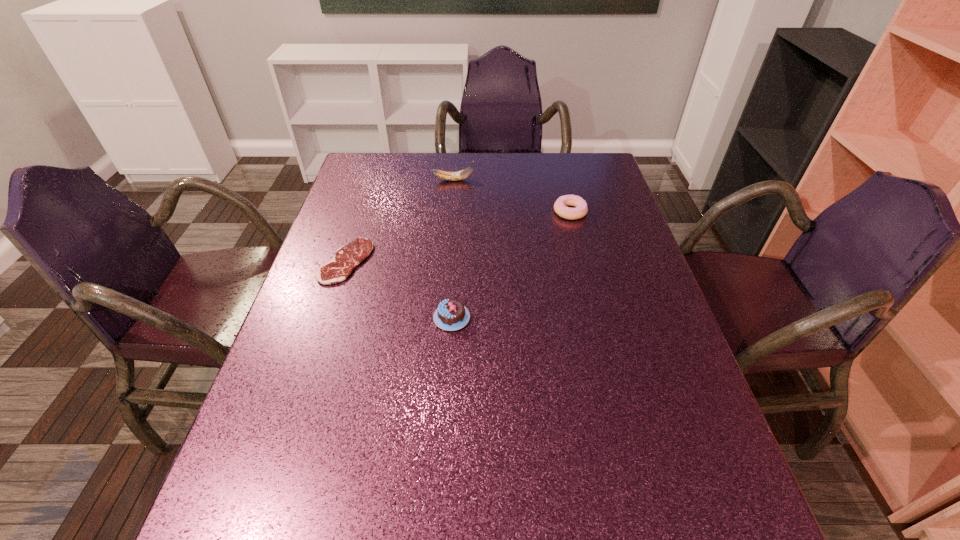
Locate an element on the screen. This screenshot has height=540, width=960. vacant space located on the right of the leftmost object is located at coordinates (420, 261).

Where is `object located in the far edge section of the desktop`? This screenshot has width=960, height=540. object located in the far edge section of the desktop is located at coordinates (459, 175).

I want to click on object present at the left edge, so click(x=347, y=257).

You are a GUI agent. You are given a task and a screenshot of the screen. Output one action in this format:
    pyautogui.click(x=<x>, y=<y>)
    Task: Click on the object at the right edge
    
    Given the screenshot: What is the action you would take?
    pyautogui.click(x=560, y=208)

Identify the location of blank space at the far edge. (485, 153).

The height and width of the screenshot is (540, 960). In the image, there is a desktop. In order to click on vacant space at the left edge in this screenshot , I will do `click(348, 209)`.

What are the coordinates of `vacant space at the right edge of the desktop` in the screenshot? It's located at (708, 430).

You are a GUI agent. You are given a task and a screenshot of the screen. Output one action in this format:
    pyautogui.click(x=<x>, y=<y>)
    Task: Click on the free region at the far left corner of the desktop
    
    Given the screenshot: What is the action you would take?
    (x=374, y=154)

Locate an element on the screen. blank area at the far right corner is located at coordinates (572, 173).

This screenshot has width=960, height=540. I want to click on vacant region at the near right corner, so click(x=747, y=533).